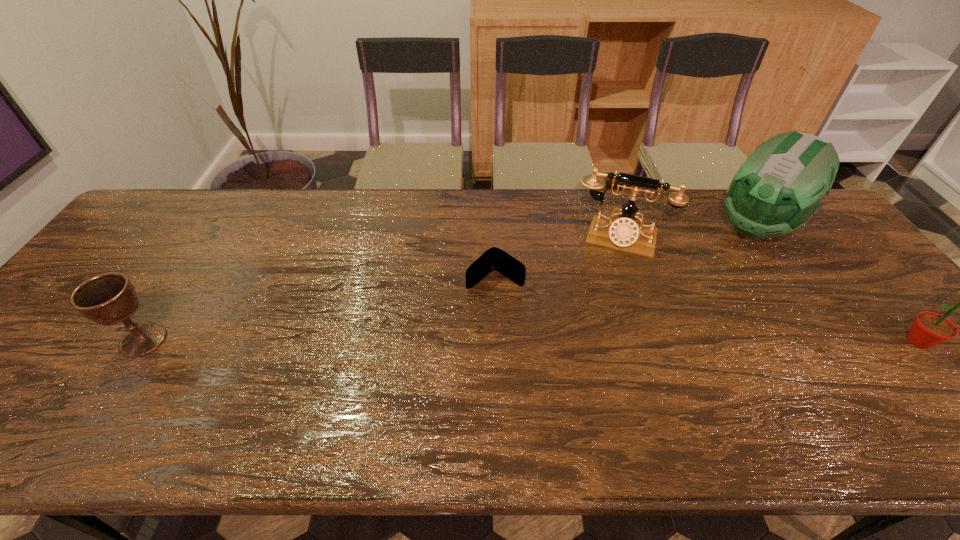
Where is `vacant space that satisfies the following two spatial constraints: 1. on the back side of the fourth object from left to right; 2. on the left side of the third object from left to right`? vacant space that satisfies the following two spatial constraints: 1. on the back side of the fourth object from left to right; 2. on the left side of the third object from left to right is located at coordinates (615, 227).